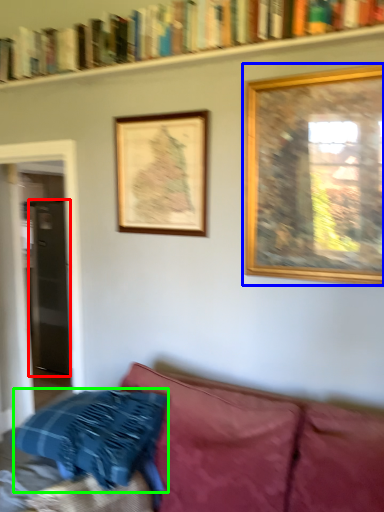
Question: Considering the real-world distances, which object is closest to glass door (highlighted by a red box)? picture frame (highlighted by a blue box) or pillow (highlighted by a green box).

Choices:
 (A) picture frame
 (B) pillow

Answer: (B)